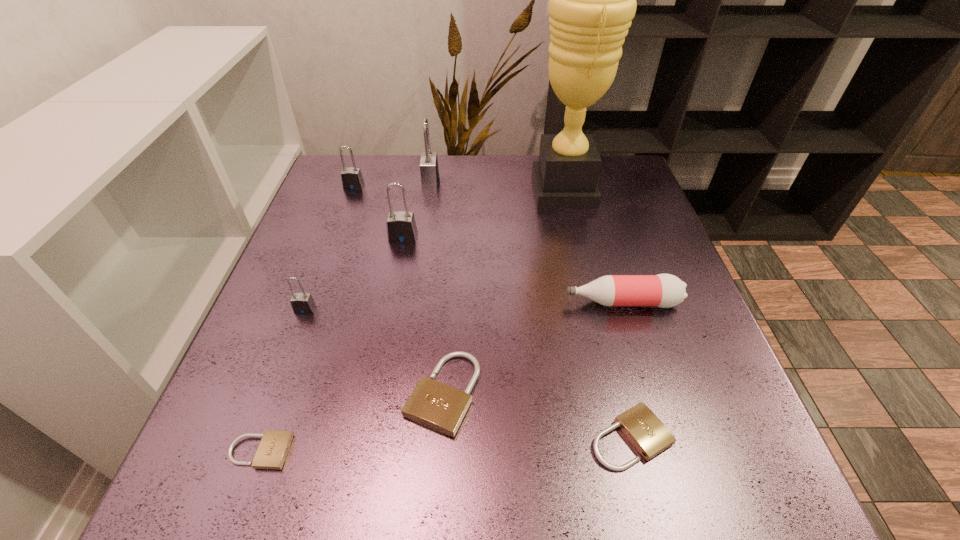
Select which gray padlock is the closest to the pink bottle. Please provide its 2D coordinates. Your answer should be formatted as a tuple, i.e. [(x, y)], where the tuple contains the x and y coordinates of a point satisfying the conditions above.

[(401, 227)]

The height and width of the screenshot is (540, 960). I want to click on the third closest beige padlock to the sixth tallest object, so click(272, 451).

Select which beige padlock is the closest to the fourth shortest object. Please provide its 2D coordinates. Your answer should be formatted as a tuple, i.e. [(x, y)], where the tuple contains the x and y coordinates of a point satisfying the conditions above.

[(438, 406)]

Locate an element on the screen. Image resolution: width=960 pixels, height=540 pixels. free space that satisfies the following two spatial constraints: 1. on the shackle of the tallest padlock; 2. on the shackle of the second nearest gray padlock is located at coordinates (422, 238).

Where is `blank space that satisfies the following two spatial constraints: 1. on the shackle of the tallest padlock; 2. on the right side of the rightmost padlock`? blank space that satisfies the following two spatial constraints: 1. on the shackle of the tallest padlock; 2. on the right side of the rightmost padlock is located at coordinates pyautogui.click(x=395, y=437).

Locate an element on the screen. The width and height of the screenshot is (960, 540). free spot that satisfies the following two spatial constraints: 1. on the shackle of the fourth farthest object; 2. on the left side of the second shortest object is located at coordinates (365, 437).

Image resolution: width=960 pixels, height=540 pixels. What are the coordinates of `vacant space that satisfies the following two spatial constraints: 1. at the front of the trophy cup with handles; 2. on the shackle of the smallest gray padlock` in the screenshot? It's located at (592, 309).

Identify the location of vacant space that satisfies the following two spatial constraints: 1. on the back side of the sixth tallest padlock; 2. on the shackle of the second tallest object. The height and width of the screenshot is (540, 960). (566, 182).